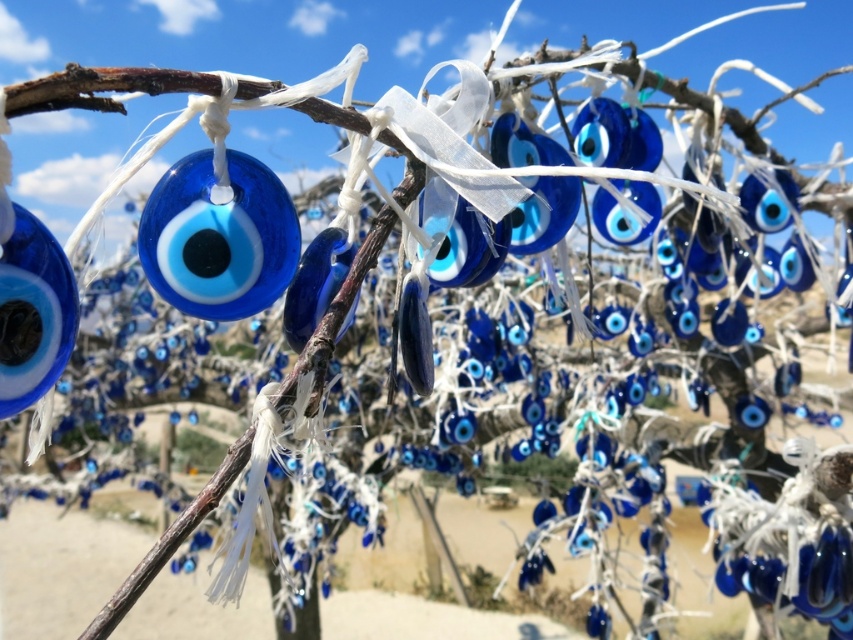
Question: Which point is farther to the camera?

Choices:
 (A) pyautogui.click(x=178, y=182)
 (B) pyautogui.click(x=10, y=369)
 (C) pyautogui.click(x=560, y=227)

Answer: (C)

Question: Does blue glass bead at left have a lesser width compared to matte glass eye at center?

Choices:
 (A) no
 (B) yes

Answer: (B)

Question: Is glossy glass eye at center to the right of blue glass bead at left from the viewer's perspective?

Choices:
 (A) no
 (B) yes

Answer: (B)

Question: Is glossy glass eye at center above blue glass bead at left?

Choices:
 (A) no
 (B) yes

Answer: (B)

Question: Which object appears closest to the camera in this image?

Choices:
 (A) blue glass bead at left
 (B) glossy glass eye at center

Answer: (A)

Question: Among these objects, which one is farthest from the camera?

Choices:
 (A) glossy glass eye at center
 (B) matte glass eye at center

Answer: (B)